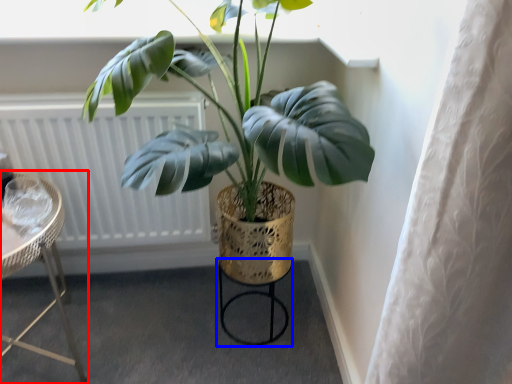
Question: Among these objects, which one is farthest to the camera, furniture (highlighted by a red box) or bar stool (highlighted by a blue box)?

Choices:
 (A) furniture
 (B) bar stool

Answer: (B)